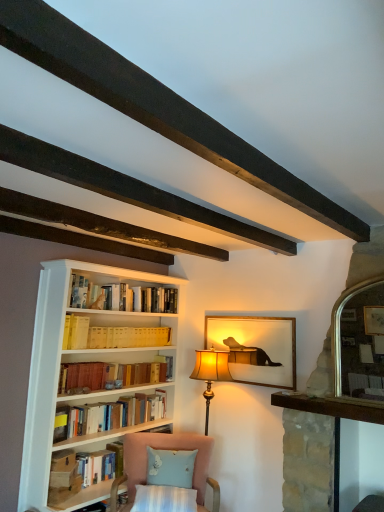
Question: Is light blue fabric pillow at lower center in front of yellow cardboard book at center, which is the 3th book from bottom to top?

Choices:
 (A) yes
 (B) no

Answer: (A)

Question: Considering the relative positions of light blue fabric pillow at lower center and yellow cardboard book at center, which is the 3th book from bottom to top, in the image provided, is light blue fabric pillow at lower center to the left of yellow cardboard book at center, which is the 3th book from bottom to top, from the viewer's perspective?

Choices:
 (A) yes
 (B) no

Answer: (B)

Question: Is light blue fabric pillow at lower center smaller than yellow cardboard book at center, which is the 3th book from bottom to top?

Choices:
 (A) yes
 (B) no

Answer: (A)

Question: Does light blue fabric pillow at lower center have a greater width compared to yellow cardboard book at center, which is the 3th book from bottom to top?

Choices:
 (A) yes
 (B) no

Answer: (A)

Question: Is light blue fabric pillow at lower center located outside yellow cardboard book at center, positioned as the first book in top-to-bottom order?

Choices:
 (A) no
 (B) yes

Answer: (B)

Question: From the image's perspective, is light blue fabric pillow at lower center located beneath yellow cardboard book at center, which is the 3th book from bottom to top?

Choices:
 (A) yes
 (B) no

Answer: (A)

Question: From a real-world perspective, is matte gold picture frame at center physically below hardcover book at lower left, the third book positioned from the top?

Choices:
 (A) no
 (B) yes

Answer: (A)

Question: Considering the relative sizes of matte gold picture frame at center and hardcover book at lower left, the third book positioned from the top, in the image provided, is matte gold picture frame at center smaller than hardcover book at lower left, the third book positioned from the top,?

Choices:
 (A) no
 (B) yes

Answer: (B)

Question: Considering the relative sizes of matte gold picture frame at center and hardcover book at lower left, the third book positioned from the top, in the image provided, is matte gold picture frame at center thinner than hardcover book at lower left, the third book positioned from the top,?

Choices:
 (A) no
 (B) yes

Answer: (B)

Question: Is matte gold picture frame at center facing away from hardcover book at lower left, placed as the first book when sorted from bottom to top?

Choices:
 (A) yes
 (B) no

Answer: (B)

Question: From the image's perspective, is matte gold picture frame at center located above hardcover book at lower left, the third book positioned from the top?

Choices:
 (A) yes
 (B) no

Answer: (A)

Question: From a real-world perspective, is matte gold picture frame at center located higher than hardcover book at lower left, the third book positioned from the top?

Choices:
 (A) no
 (B) yes

Answer: (B)

Question: Is matte gold picture frame at center thinner than pink fabric chair at lower center?

Choices:
 (A) yes
 (B) no

Answer: (A)